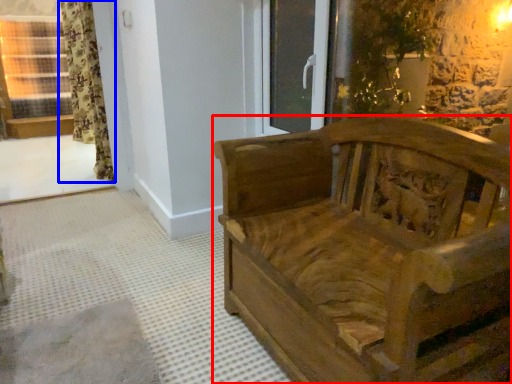
Question: Which object is further to the camera taking this photo, furniture (highlighted by a red box) or curtain (highlighted by a blue box)?

Choices:
 (A) furniture
 (B) curtain

Answer: (B)